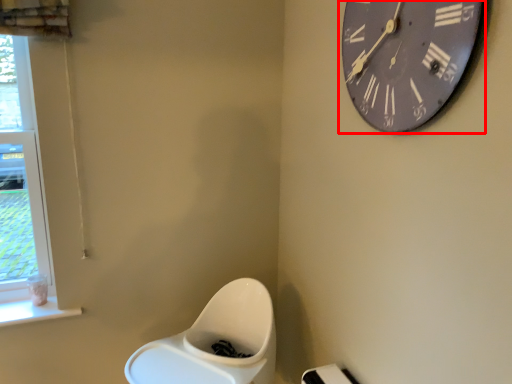
Question: From the image's perspective, where is wall clock (annotated by the red box) located relative to window?

Choices:
 (A) below
 (B) above

Answer: (B)